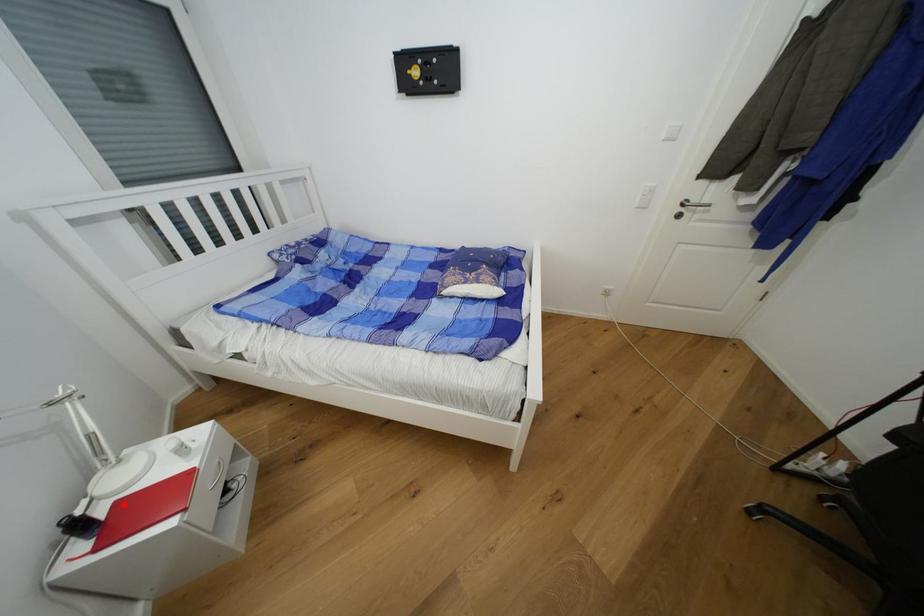
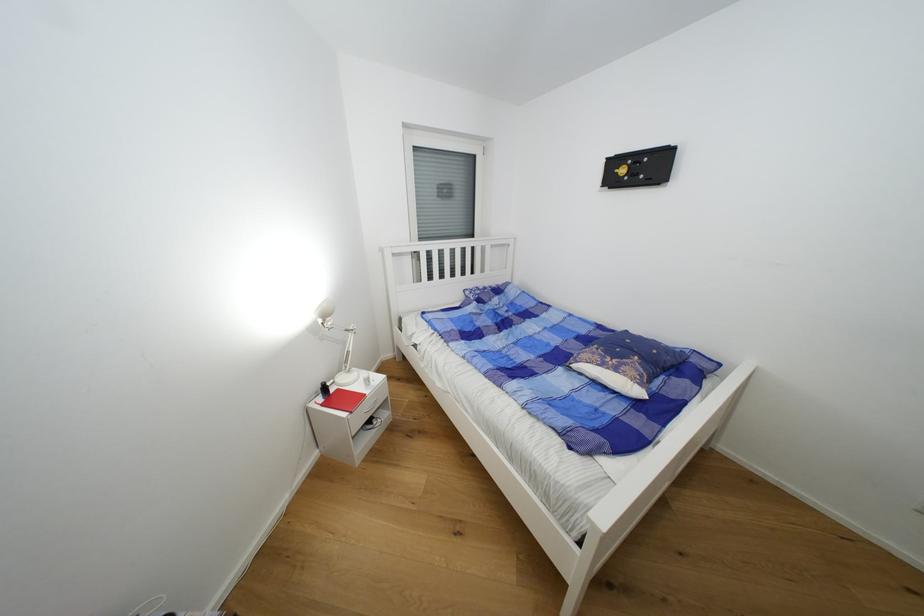
Locate, in the second image, the point that corresponds to the highlighted location in the first image.

(344, 392)